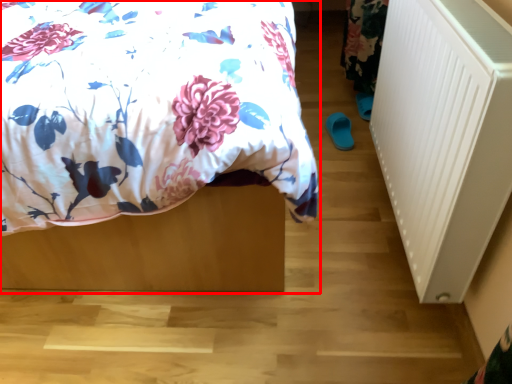
Question: In this image, where is bed (annotated by the red box) located relative to radiator?

Choices:
 (A) left
 (B) right

Answer: (A)